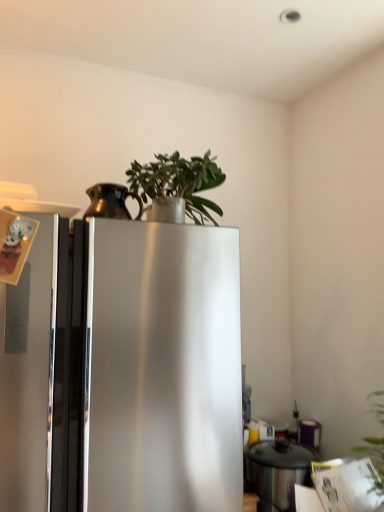
Question: Is bronze metallic pitcher at upper left, acting as the second appliance starting from the bottom, directly adjacent to green matte plant at upper center?

Choices:
 (A) yes
 (B) no

Answer: (B)

Question: Is bronze metallic pitcher at upper left, the second appliance in the back-to-front sequence, positioned in front of green matte plant at upper center?

Choices:
 (A) no
 (B) yes

Answer: (A)

Question: Is bronze metallic pitcher at upper left, marked as the first appliance in a left-to-right arrangement, surrounding green matte plant at upper center?

Choices:
 (A) yes
 (B) no

Answer: (B)

Question: Can you confirm if bronze metallic pitcher at upper left, the 1th appliance from the top, is thinner than green matte plant at upper center?

Choices:
 (A) yes
 (B) no

Answer: (A)

Question: Is bronze metallic pitcher at upper left, marked as the second appliance in a right-to-left arrangement, far from green matte plant at upper center?

Choices:
 (A) yes
 (B) no

Answer: (B)

Question: From the image's perspective, is bronze metallic pitcher at upper left, the 1th appliance from the top, positioned above or below satin silver refrigerator at center?

Choices:
 (A) below
 (B) above

Answer: (B)

Question: Based on their sizes in the image, would you say bronze metallic pitcher at upper left, marked as the second appliance in a right-to-left arrangement, is bigger or smaller than satin silver refrigerator at center?

Choices:
 (A) small
 (B) big

Answer: (A)

Question: Is point (112, 188) positioned closer to the camera than point (31, 385)?

Choices:
 (A) closer
 (B) farther

Answer: (B)

Question: Do you think bronze metallic pitcher at upper left, the 1th appliance from the top, is within satin silver refrigerator at center, or outside of it?

Choices:
 (A) inside
 (B) outside

Answer: (B)

Question: In terms of height, does stainless steel pot at lower right, the second appliance in the front-to-back sequence, look taller or shorter compared to bronze metallic pitcher at upper left, the 1th appliance in the front-to-back sequence?

Choices:
 (A) tall
 (B) short

Answer: (A)

Question: In the image, is stainless steel pot at lower right, the first appliance viewed from the back, positioned in front of or behind bronze metallic pitcher at upper left, the 1th appliance in the front-to-back sequence?

Choices:
 (A) front
 (B) behind

Answer: (B)

Question: Choose the correct answer: Is stainless steel pot at lower right, the first appliance viewed from the back, inside bronze metallic pitcher at upper left, the 1th appliance in the front-to-back sequence, or outside it?

Choices:
 (A) outside
 (B) inside

Answer: (A)

Question: Is stainless steel pot at lower right, the 1th appliance from the right, wider or thinner than bronze metallic pitcher at upper left, marked as the second appliance in a right-to-left arrangement?

Choices:
 (A) thin
 (B) wide

Answer: (B)

Question: Does point (273, 480) appear closer or farther from the camera than point (195, 206)?

Choices:
 (A) closer
 (B) farther

Answer: (A)

Question: From the image's perspective, is stainless steel pot at lower right, the first appliance viewed from the back, positioned above or below green matte plant at upper center?

Choices:
 (A) below
 (B) above

Answer: (A)